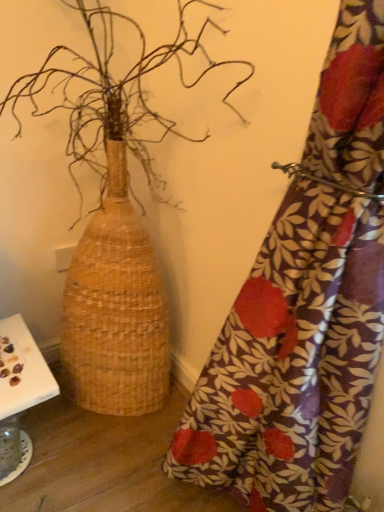
Question: Is white paper at lower left in contact with natural woven basket at left?

Choices:
 (A) no
 (B) yes

Answer: (A)

Question: Does white paper at lower left turn towards natural woven basket at left?

Choices:
 (A) no
 (B) yes

Answer: (B)

Question: Considering the relative sizes of white paper at lower left and natural woven basket at left in the image provided, is white paper at lower left thinner than natural woven basket at left?

Choices:
 (A) yes
 (B) no

Answer: (A)

Question: Does white paper at lower left have a greater height compared to natural woven basket at left?

Choices:
 (A) yes
 (B) no

Answer: (B)

Question: From the image's perspective, would you say white paper at lower left is shown under natural woven basket at left?

Choices:
 (A) no
 (B) yes

Answer: (B)

Question: Can you confirm if white paper at lower left is shorter than natural woven basket at left?

Choices:
 (A) yes
 (B) no

Answer: (A)

Question: Would you say natural woven basket at left is a long distance from white paper at lower left?

Choices:
 (A) yes
 (B) no

Answer: (B)

Question: From a real-world perspective, is natural woven basket at left over white paper at lower left?

Choices:
 (A) yes
 (B) no

Answer: (A)

Question: Does natural woven basket at left contain white paper at lower left?

Choices:
 (A) no
 (B) yes

Answer: (B)

Question: Could you tell me if natural woven basket at left is turned towards white paper at lower left?

Choices:
 (A) no
 (B) yes

Answer: (A)

Question: Is natural woven basket at left not inside white paper at lower left?

Choices:
 (A) yes
 (B) no

Answer: (A)

Question: From the image's perspective, is natural woven basket at left beneath white paper at lower left?

Choices:
 (A) yes
 (B) no

Answer: (B)

Question: Is floral fabric curtain at right wider than natural woven basket at left?

Choices:
 (A) yes
 (B) no

Answer: (B)